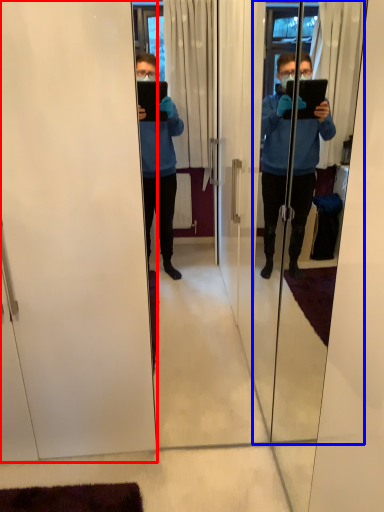
Question: Which point is closer to the camera, screen door (highlighted by a red box) or screen door (highlighted by a blue box)?

Choices:
 (A) screen door
 (B) screen door

Answer: (B)